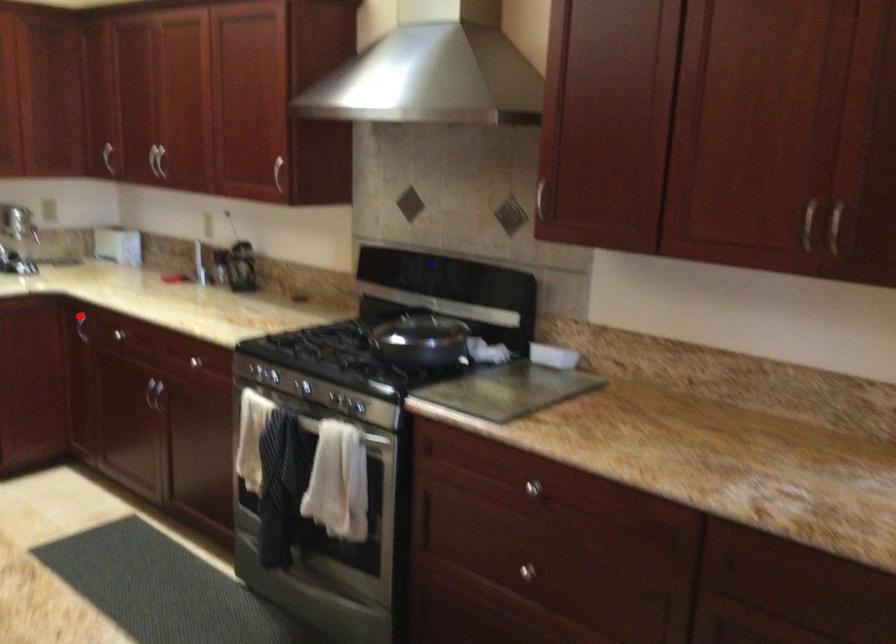
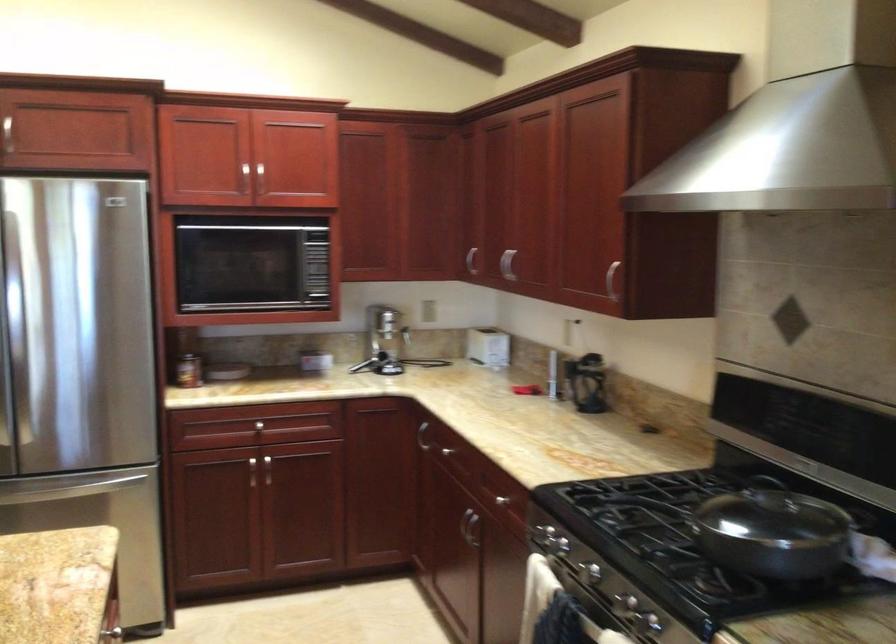
Question: I am providing you with two images of the same scene from different viewpoints. A red point is marked on the first image. Is the red point's position out of view in image 2?

Choices:
 (A) Yes
 (B) No

Answer: (B)